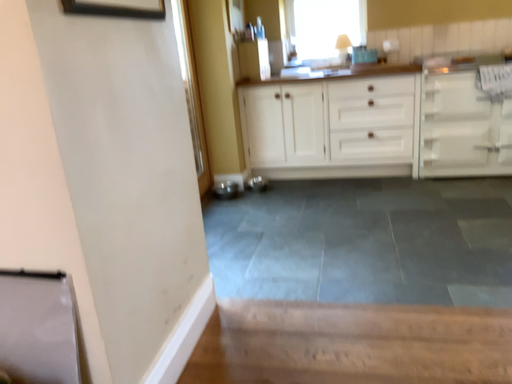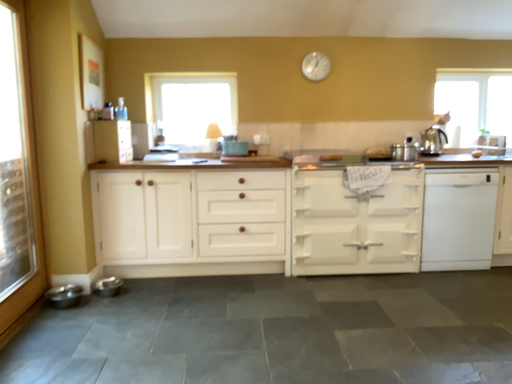
Question: Which way did the camera rotate in the video?

Choices:
 (A) rotated upward
 (B) rotated downward

Answer: (A)